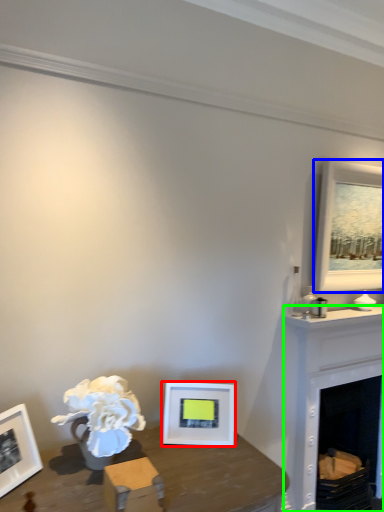
Question: Which object is the closest to the picture frame (highlighted by a red box)? Choose among these: picture frame (highlighted by a blue box) or fireplace (highlighted by a green box).

Choices:
 (A) picture frame
 (B) fireplace

Answer: (B)